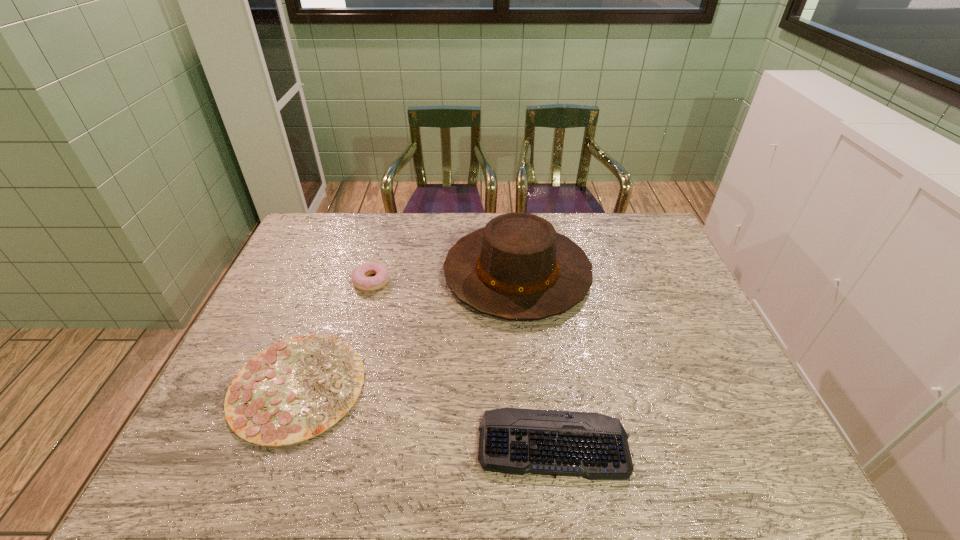
At what (x,y) coordinates should I click in order to perform the action: click on vacant point that satisfies the following two spatial constraints: 1. on the back side of the second shortest object; 2. on the right side of the doughnut. Please return your answer as a coordinate pair (x, y). Looking at the image, I should click on (336, 281).

Where is `blank area in the image that satisfies the following two spatial constraints: 1. on the back side of the cowboy hat; 2. on the right side of the second shortest object`? blank area in the image that satisfies the following two spatial constraints: 1. on the back side of the cowboy hat; 2. on the right side of the second shortest object is located at coordinates (339, 273).